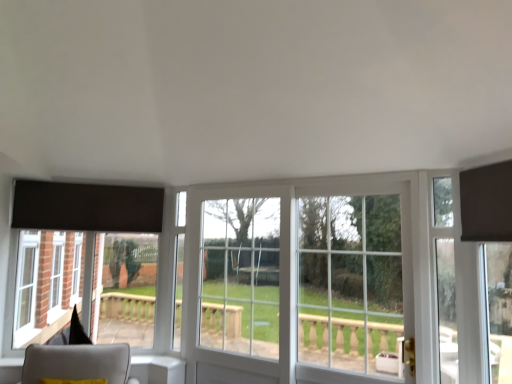
Question: Is light gray fabric chair at lower left shorter than matte black curtain at upper right?

Choices:
 (A) no
 (B) yes

Answer: (B)

Question: Can you confirm if light gray fabric chair at lower left is wider than matte black curtain at upper right?

Choices:
 (A) yes
 (B) no

Answer: (A)

Question: Is light gray fabric chair at lower left not close to matte black curtain at upper right?

Choices:
 (A) yes
 (B) no

Answer: (A)

Question: Can you confirm if light gray fabric chair at lower left is positioned to the right of matte black curtain at upper right?

Choices:
 (A) no
 (B) yes

Answer: (A)

Question: From a real-world perspective, is light gray fabric chair at lower left beneath matte black curtain at upper right?

Choices:
 (A) yes
 (B) no

Answer: (A)

Question: Does point (398, 307) appear closer or farther from the camera than point (276, 193)?

Choices:
 (A) closer
 (B) farther

Answer: (A)

Question: Considering the positions of clear glass door at right and clear glass door at center in the image, is clear glass door at right bigger or smaller than clear glass door at center?

Choices:
 (A) big
 (B) small

Answer: (A)

Question: From the image's perspective, is clear glass door at right located above or below clear glass door at center?

Choices:
 (A) above
 (B) below

Answer: (A)

Question: Is clear glass door at right taller or shorter than clear glass door at center?

Choices:
 (A) tall
 (B) short

Answer: (B)

Question: Looking at their shapes, would you say clear glass door at right is wider or thinner than light gray fabric chair at lower left?

Choices:
 (A) wide
 (B) thin

Answer: (B)

Question: Considering their positions, is clear glass door at right located in front of or behind light gray fabric chair at lower left?

Choices:
 (A) behind
 (B) front

Answer: (B)

Question: Is point (320, 216) closer or farther from the camera than point (106, 354)?

Choices:
 (A) closer
 (B) farther

Answer: (A)

Question: In terms of height, does clear glass door at right look taller or shorter compared to light gray fabric chair at lower left?

Choices:
 (A) tall
 (B) short

Answer: (A)

Question: Based on their sizes in the image, would you say matte black curtain at upper right is bigger or smaller than clear glass window at center?

Choices:
 (A) small
 (B) big

Answer: (A)

Question: Is point (480, 208) positioned closer to the camera than point (369, 336)?

Choices:
 (A) farther
 (B) closer

Answer: (B)